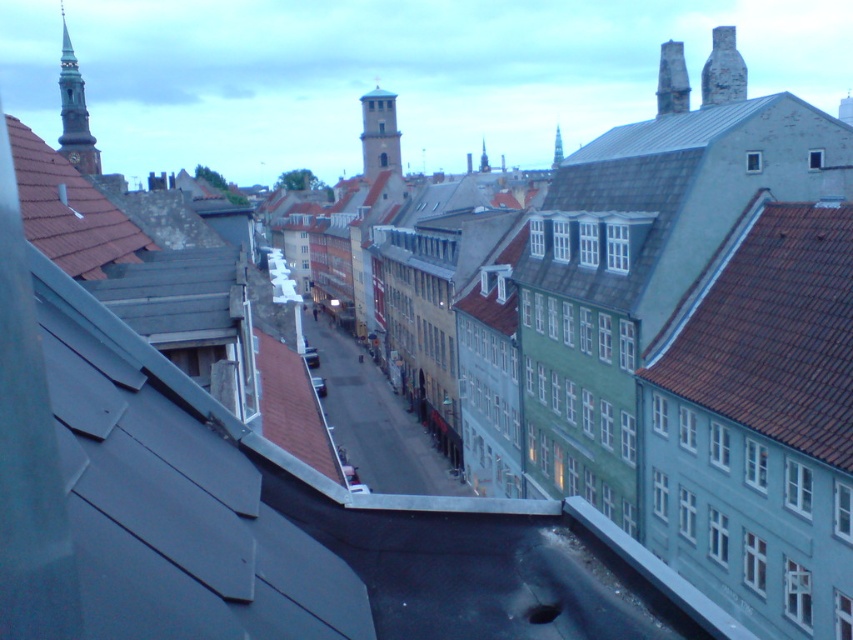
You are standing on a rooftop and want to take a photo of both the smooth stone spire at upper left and the smooth stone tower at center. Which one should you adjust your camera focus to first to ensure it appears sharp in the photo?

You should focus on the smooth stone spire at upper left first because it is closer to the viewer than the smooth stone tower at center, so adjusting focus starting from the closer object ensures both can be in focus if within the depth of field.